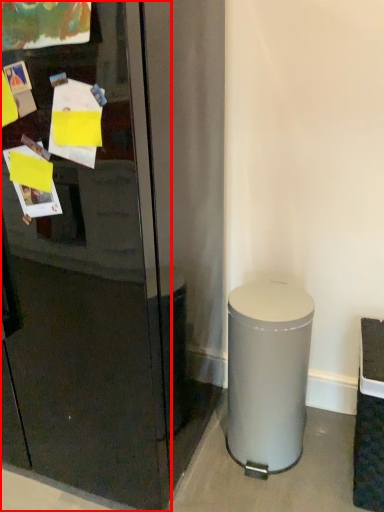
Question: From the image, what is the correct spatial relationship of glass door (annotated by the red box) in relation to trash bin/can?

Choices:
 (A) left
 (B) right

Answer: (A)